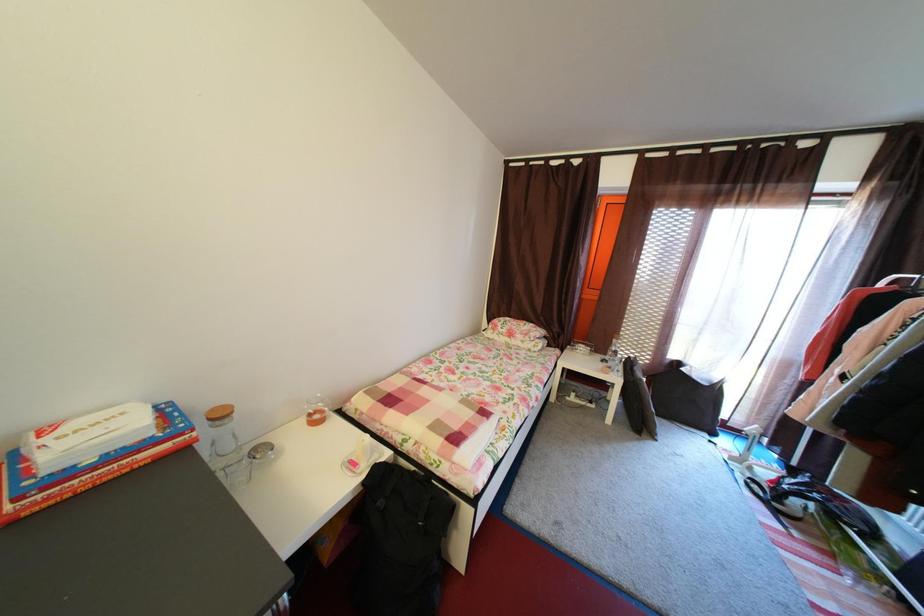
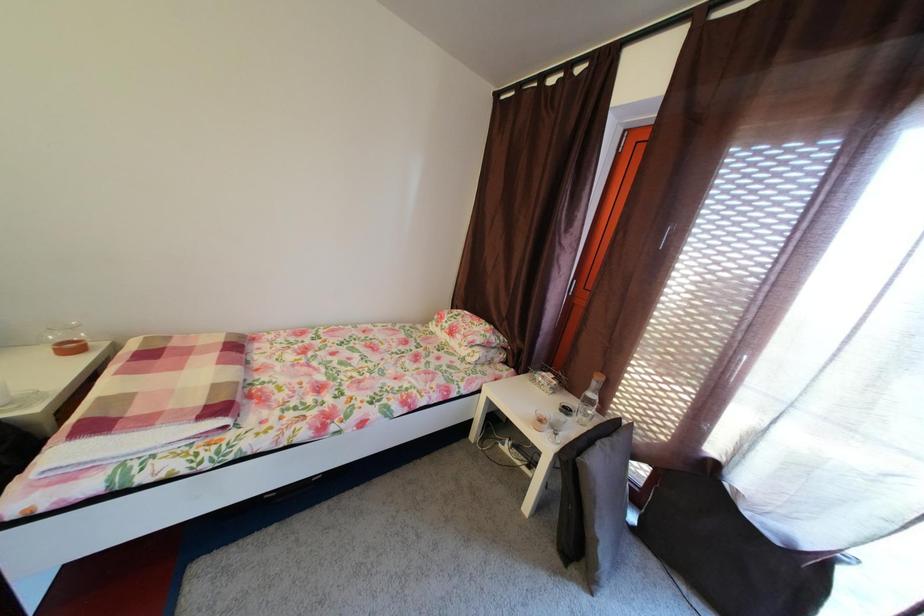
In a continuous first-person perspective shot, in which direction is the camera moving?

The cameraman walked toward right, forward.